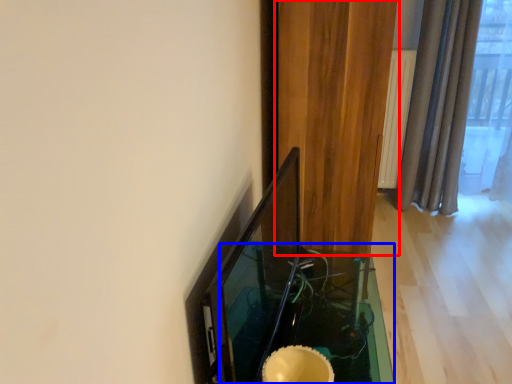
Question: Which object appears farthest to the camera in this image, curtain (highlighted by a red box) or table (highlighted by a blue box)?

Choices:
 (A) curtain
 (B) table

Answer: (A)